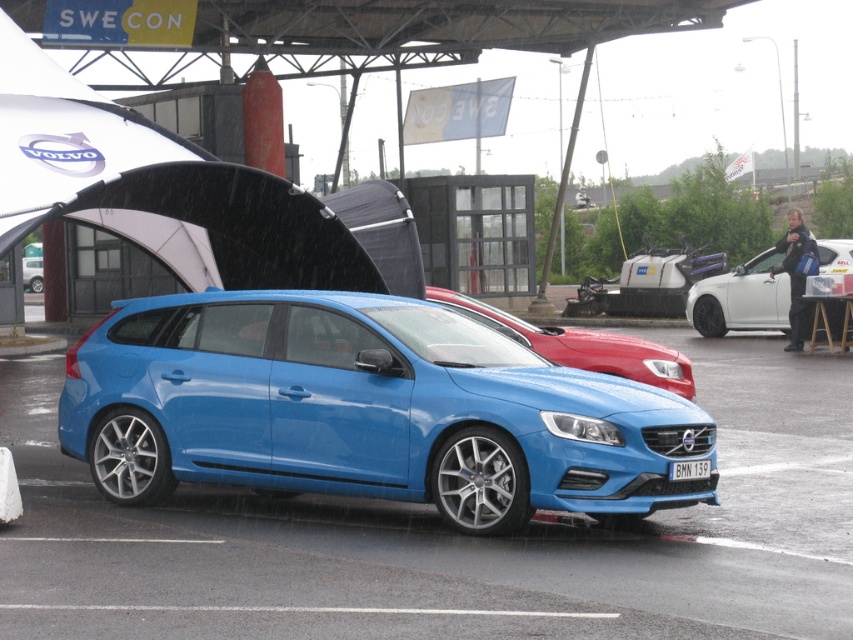
Question: Considering the real-world distances, which object is closest to the white plastic license plate at center?

Choices:
 (A) white glossy sedan at center
 (B) blue metallic hatchback at center

Answer: (B)

Question: Is matte blue hatchback at center thinner than white glossy sedan at center?

Choices:
 (A) no
 (B) yes

Answer: (A)

Question: Which object appears closest to the camera in this image?

Choices:
 (A) matte blue hatchback at center
 (B) blue metallic hatchback at center
 (C) white glossy sedan at center

Answer: (A)

Question: From the image, what is the correct spatial relationship of matte blue hatchback at center in relation to white plastic license plate at center?

Choices:
 (A) below
 (B) above

Answer: (B)

Question: Does white glossy sedan at center have a greater width compared to white plastic license plate at center?

Choices:
 (A) yes
 (B) no

Answer: (B)

Question: Estimate the real-world distances between objects in this image. Which object is farther from the white plastic license plate at center?

Choices:
 (A) white glossy sedan at center
 (B) blue metallic hatchback at center

Answer: (A)